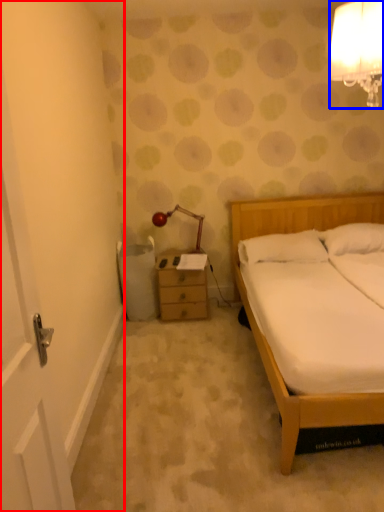
Question: Which object appears closest to the camera in this image, door (highlighted by a red box) or lamp (highlighted by a blue box)?

Choices:
 (A) door
 (B) lamp

Answer: (A)